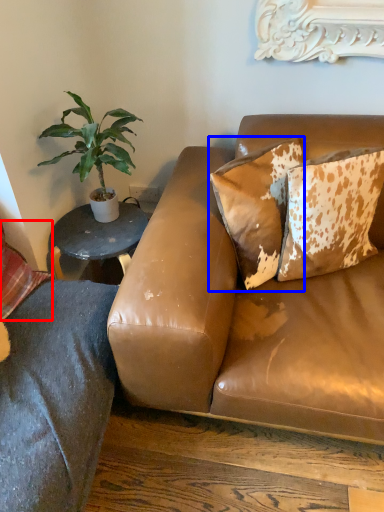
Question: Which object appears farthest to the camera in this image, pillow (highlighted by a red box) or pillow (highlighted by a blue box)?

Choices:
 (A) pillow
 (B) pillow

Answer: (B)